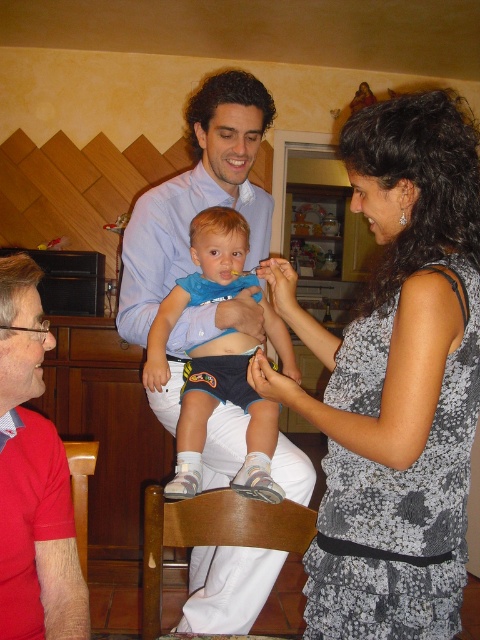
You are a photographer setting up for a family photo in the kitchen. You have a camera on a tripod that needs to be placed so it doesn not block the view of either the floral dress at center or the wooden chair at lower left. Given their heights, which object might require the tripod to be positioned lower to avoid obstruction?

The floral dress at center is taller than the wooden chair at lower left, so the tripod should be positioned lower to avoid blocking the view of the floral dress at center.